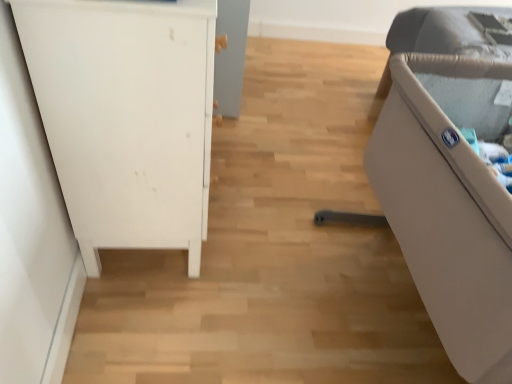
Find the location of a particular element. The width and height of the screenshot is (512, 384). vacant area situated below beige plastic crib at right, the 1th furniture when ordered from right to left (from a real-world perspective) is located at coordinates (381, 304).